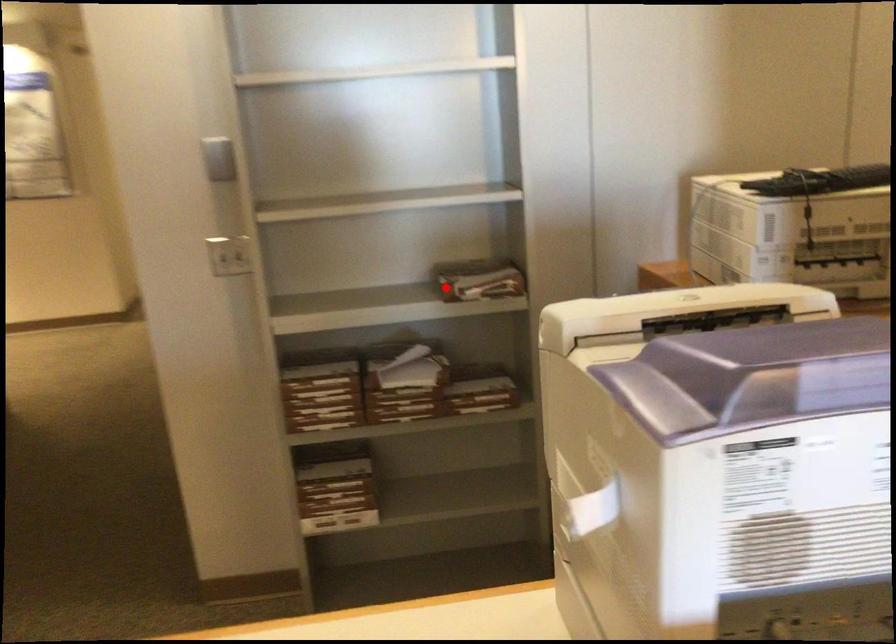
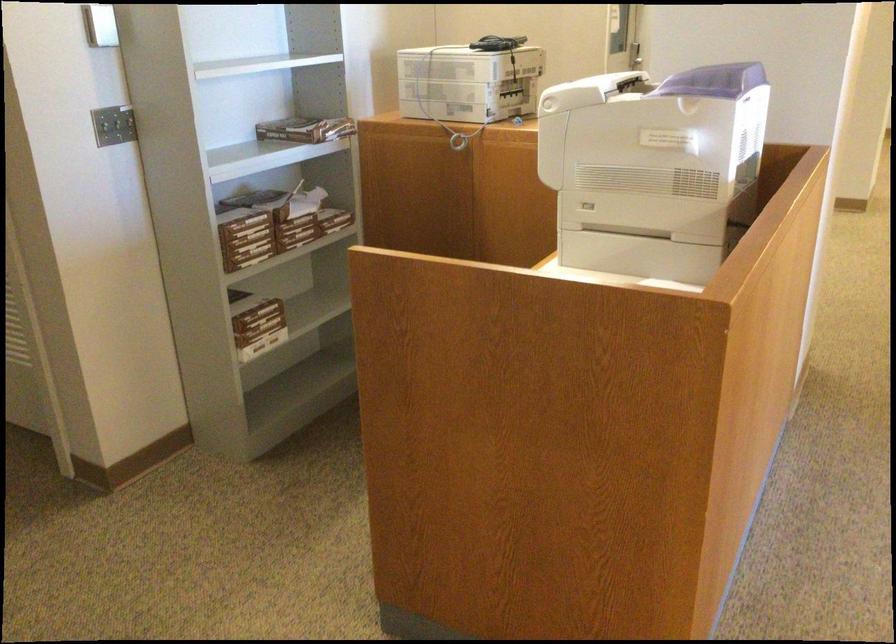
Question: A red point is marked in image1. In image2, is the corresponding 3D point closer to the camera or farther? Reply with the corresponding letter.

Choices:
 (A) The corresponding 3D point is closer.
 (B) The corresponding 3D point is farther.

Answer: (B)